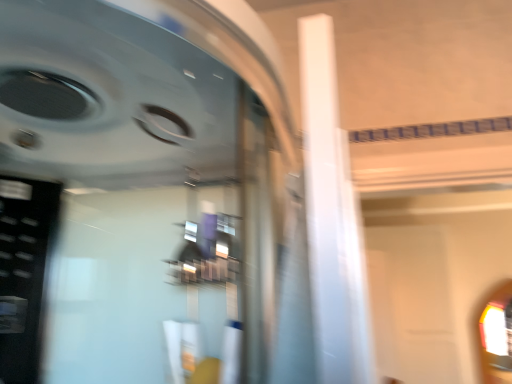
Question: Should I look upward or downward to see transparent glass at right?

Choices:
 (A) up
 (B) down

Answer: (B)